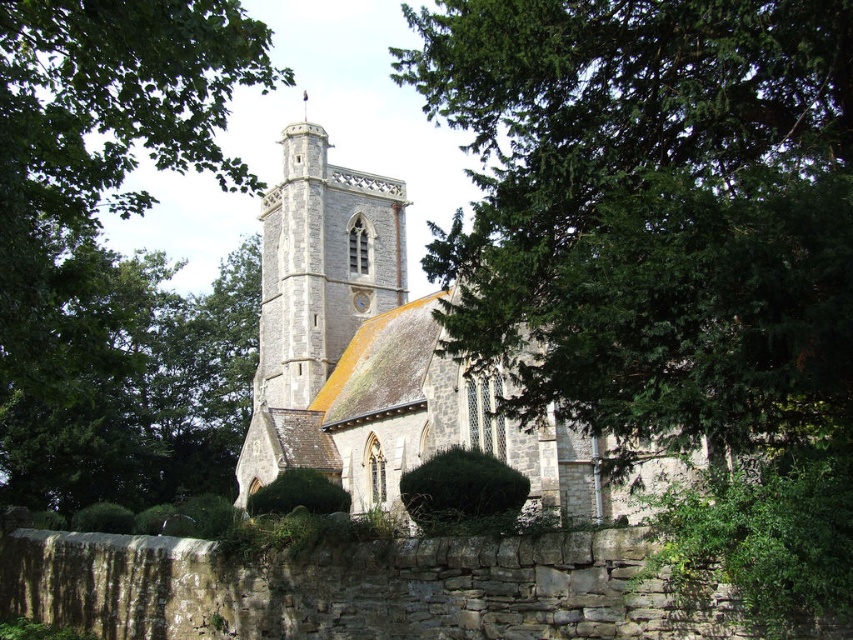
Question: Where is stone church at center located in relation to stone tower at center in the image?

Choices:
 (A) left
 (B) right

Answer: (B)

Question: Which point is closer to the camera?

Choices:
 (A) stone church at center
 (B) stone tower at center

Answer: (A)

Question: Does stone church at center have a smaller size compared to stone tower at center?

Choices:
 (A) no
 (B) yes

Answer: (A)

Question: Does stone church at center appear over stone tower at center?

Choices:
 (A) no
 (B) yes

Answer: (A)